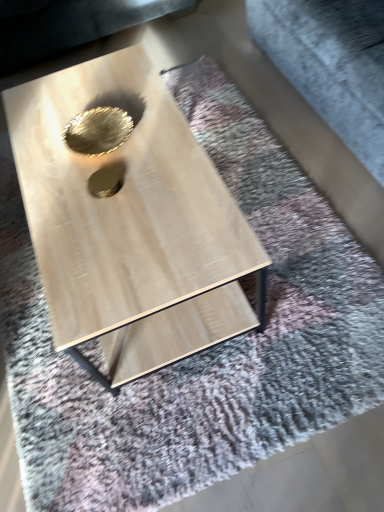
Where is `free region on the left part of gold metallic hole at center, placed as the 1th hole when sorted from bottom to top`? free region on the left part of gold metallic hole at center, placed as the 1th hole when sorted from bottom to top is located at coordinates (51, 194).